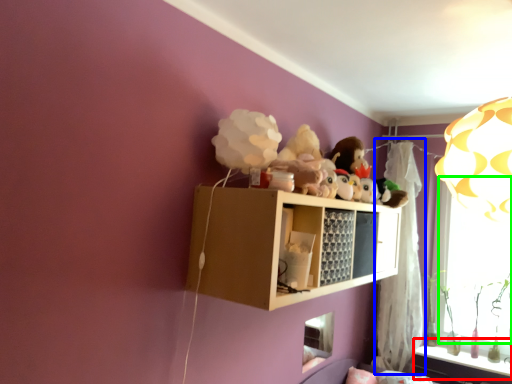
Question: Which is nearer to the window sill (highlighted by a red box)? curtain (highlighted by a blue box) or window screen (highlighted by a green box).

Choices:
 (A) curtain
 (B) window screen

Answer: (A)